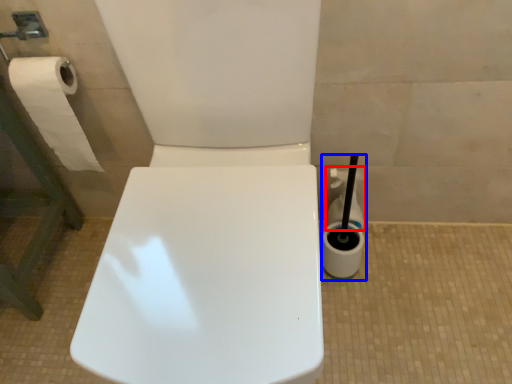
Question: Which of the following is the closest to the observer, cleaning product (highlighted by a red box) or cleaning product (highlighted by a blue box)?

Choices:
 (A) cleaning product
 (B) cleaning product

Answer: (B)